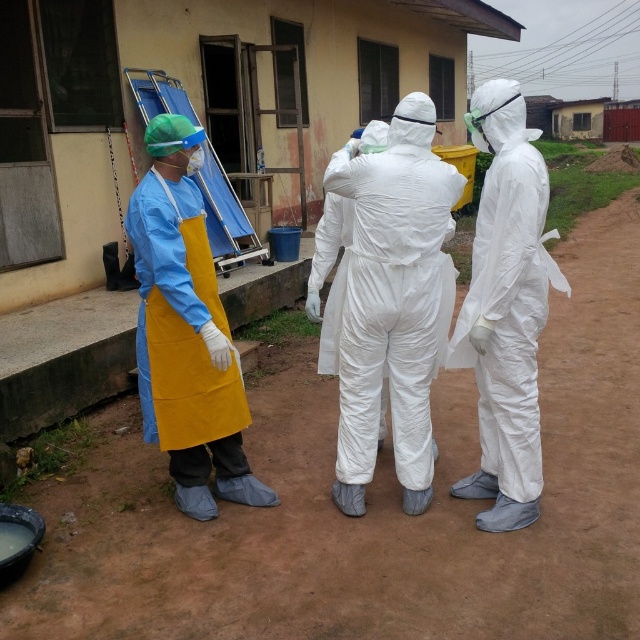
Question: Which object appears closest to the camera in this image?

Choices:
 (A) white matte/soft robe at center
 (B) brown dirt track at center
 (C) yellow matte apron at left

Answer: (C)

Question: Which object is farther from the camera taking this photo?

Choices:
 (A) brown dirt track at center
 (B) white matte/soft robe at center
 (C) white matte/soft suit at right

Answer: (A)

Question: Which object is the closest to the white matte/soft suit at right?

Choices:
 (A) yellow matte apron at left
 (B) brown dirt track at center

Answer: (A)

Question: Can you confirm if white matte/soft robe at center is positioned to the left of white matte/soft suit at right?

Choices:
 (A) yes
 (B) no

Answer: (A)

Question: Does white matte/soft robe at center have a larger size compared to yellow matte apron at left?

Choices:
 (A) yes
 (B) no

Answer: (B)

Question: Can you confirm if yellow matte apron at left is positioned to the right of white matte/soft suit at right?

Choices:
 (A) no
 (B) yes

Answer: (A)